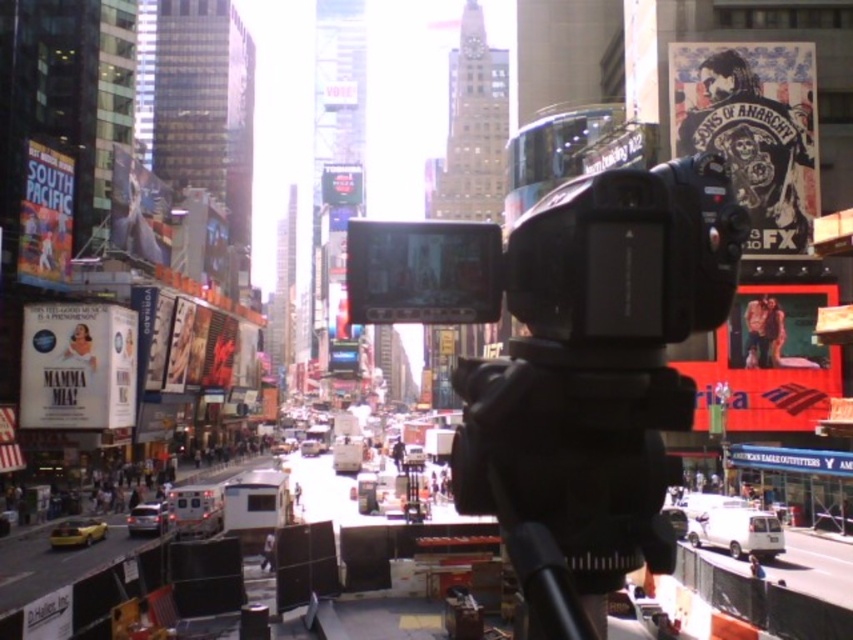
Which is more to the right, black matte tripod at center or metallic silver van at lower left?

black matte tripod at center is more to the right.

Does black matte tripod at center appear on the left side of metallic silver van at lower left?

No, black matte tripod at center is not to the left of metallic silver van at lower left.

Describe the element at coordinates (573, 452) in the screenshot. I see `black matte tripod at center` at that location.

The height and width of the screenshot is (640, 853). Find the location of `black matte tripod at center`. black matte tripod at center is located at coordinates (x=573, y=452).

Measure the distance between black plastic video camera at center and metallic silver van at lower left.

black plastic video camera at center is 69.98 meters away from metallic silver van at lower left.

Is black plastic video camera at center smaller than metallic silver van at lower left?

No.

Where is `black plastic video camera at center`? This screenshot has height=640, width=853. black plastic video camera at center is located at coordinates (570, 356).

Who is taller, black plastic video camera at center or black matte tripod at center?

black plastic video camera at center

Is black plastic video camera at center below black matte tripod at center?

No.

This screenshot has height=640, width=853. What do you see at coordinates (570, 356) in the screenshot?
I see `black plastic video camera at center` at bounding box center [570, 356].

The image size is (853, 640). Find the location of `black plastic video camera at center`. black plastic video camera at center is located at coordinates (570, 356).